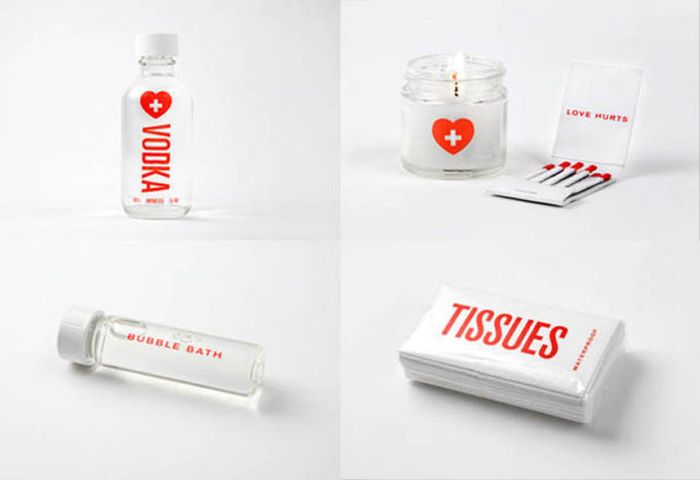
The image size is (700, 480). I want to click on candle, so (448, 146).